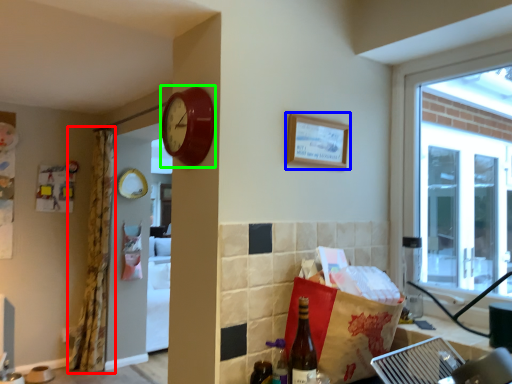
Question: Estimate the real-world distances between objects in this image. Which object is farther from curtain (highlighted by a red box), picture frame (highlighted by a blue box) or clock (highlighted by a green box)?

Choices:
 (A) picture frame
 (B) clock

Answer: (A)